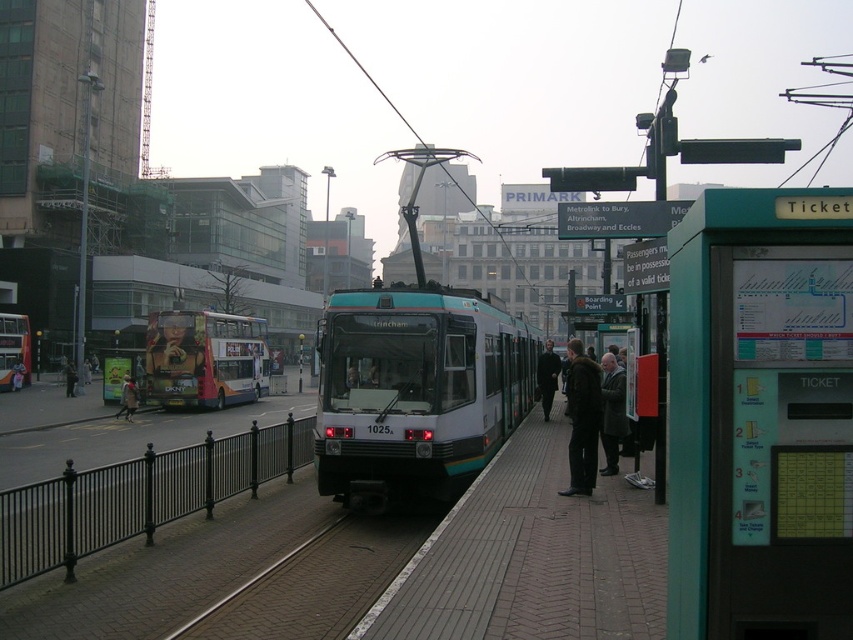
Question: Which point appears farthest from the camera in this image?

Choices:
 (A) (4, 378)
 (B) (553, 358)

Answer: (A)

Question: Which object appears farthest from the camera in this image?

Choices:
 (A) dark brown leather jacket at center
 (B) teal plastic ticket machine at right
 (C) dark blue coat at center
 (D) dark brown leather coat at center

Answer: (A)

Question: Can you confirm if teal glossy tram at center is positioned below dark brown leather coat at center?

Choices:
 (A) no
 (B) yes

Answer: (A)

Question: Is teal plastic ticket machine at right in front of dark blue coat at center?

Choices:
 (A) yes
 (B) no

Answer: (A)

Question: Is teal plastic ticket machine at right thinner than matte black bus at left?

Choices:
 (A) no
 (B) yes

Answer: (B)

Question: Among these objects, which one is nearest to the camera?

Choices:
 (A) dark brown leather coat at center
 (B) dark gray wool coat at center
 (C) teal plastic ticket machine at right

Answer: (C)